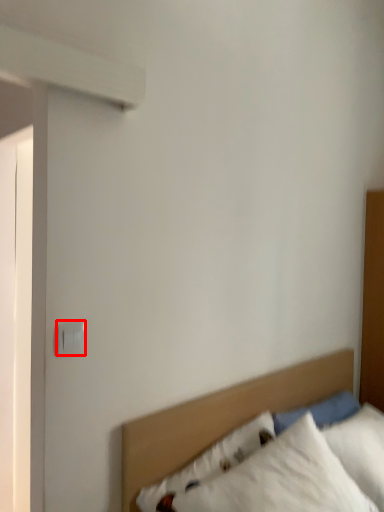
Question: Where is electric outlet (annotated by the red box) located in relation to bed in the image?

Choices:
 (A) right
 (B) left

Answer: (B)